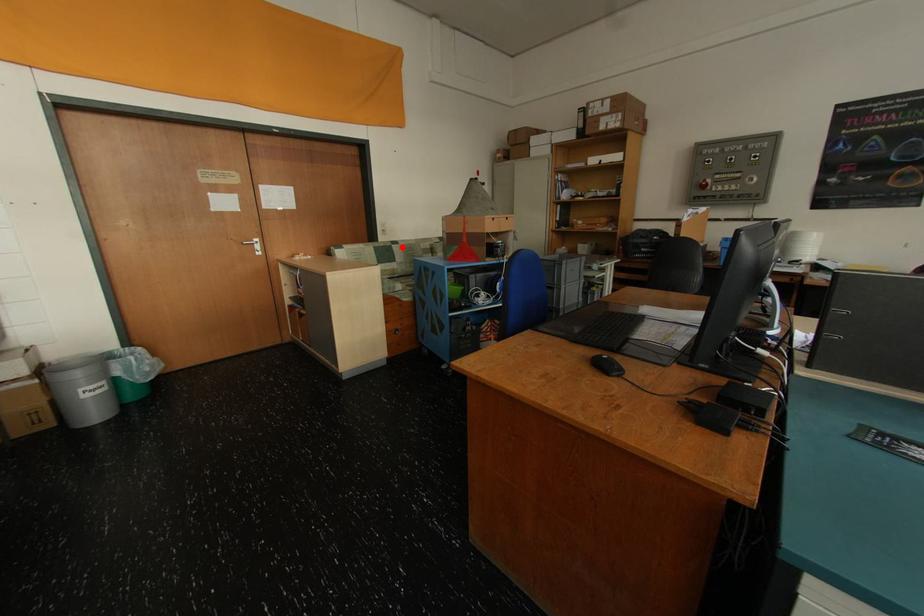
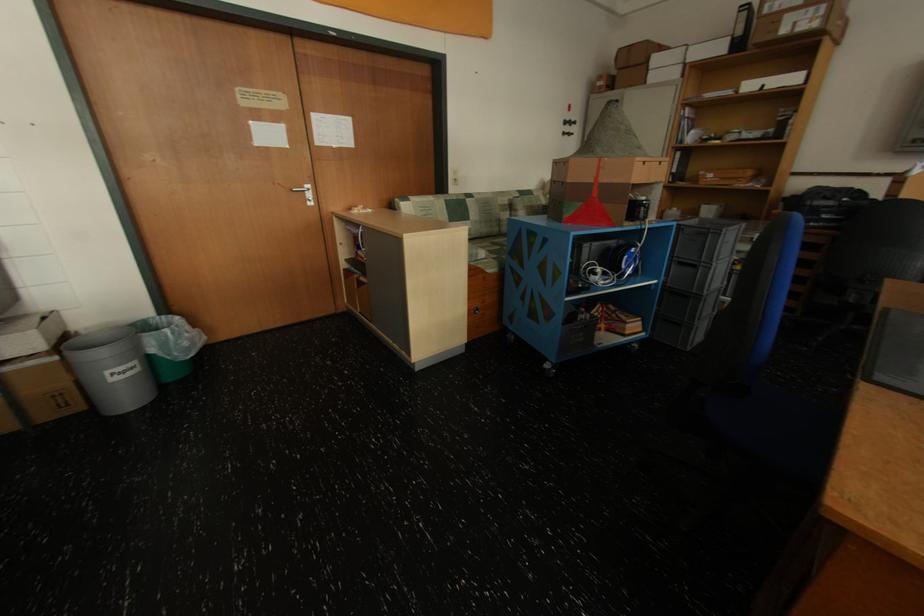
Locate, in the second image, the point that corresponds to the highlighted location in the first image.

(476, 201)